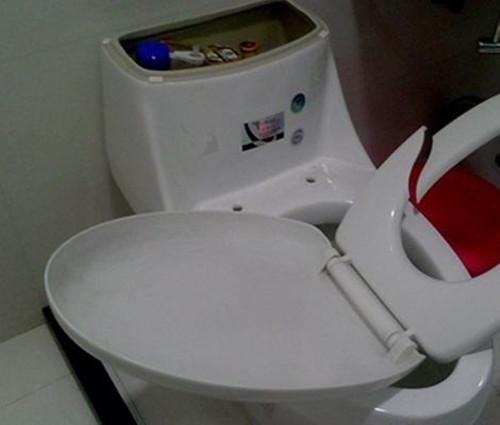
Find the location of a particular element. The image size is (500, 425). shadow on wall is located at coordinates (410, 50).